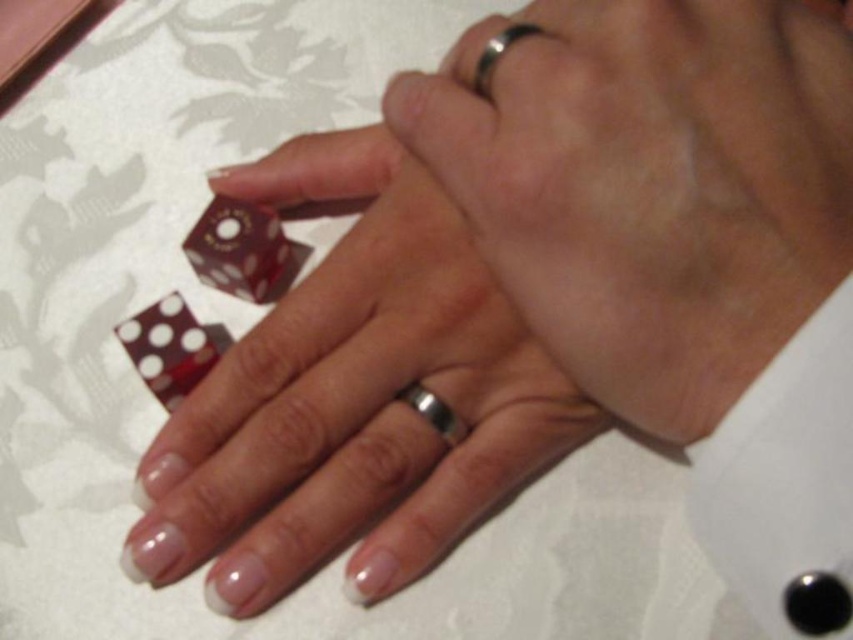
Question: Is silver/metallic ring at center above silver/metallic ring at upper center?

Choices:
 (A) no
 (B) yes

Answer: (A)

Question: Among these points, which one is nearest to the camera?

Choices:
 (A) (502, 33)
 (B) (456, 417)

Answer: (A)

Question: Which point is farther to the camera?

Choices:
 (A) matte plastic dice at center
 (B) silver/metallic ring at upper center
 (C) silver metallic ring at center
 (D) silver/metallic ring at center

Answer: (D)

Question: Which point is closer to the camera taking this photo?

Choices:
 (A) (519, 26)
 (B) (627, 100)

Answer: (B)

Question: Does silver metallic ring at center appear under silver/metallic ring at upper center?

Choices:
 (A) yes
 (B) no

Answer: (A)

Question: Is matte plastic dice at center behind silver/metallic ring at upper center?

Choices:
 (A) no
 (B) yes

Answer: (B)